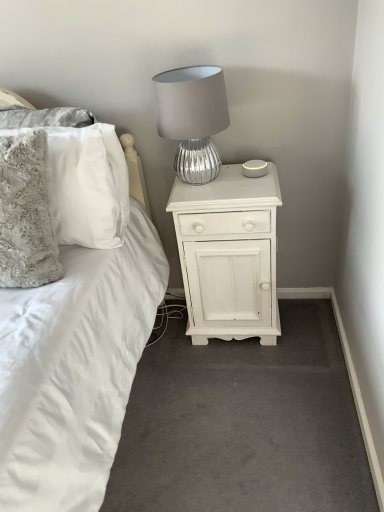
Question: From the image's perspective, is white painted wood nightstand at center positioned above or below fluffy gray pillow at left, marked as the 1th pillow in a front-to-back arrangement?

Choices:
 (A) above
 (B) below

Answer: (B)

Question: From a real-world perspective, is white painted wood nightstand at center positioned above or below fluffy gray pillow at left, marked as the 1th pillow in a front-to-back arrangement?

Choices:
 (A) above
 (B) below

Answer: (B)

Question: Which is nearer to the fluffy gray pillow at left, marked as the 1th pillow in a front-to-back arrangement?

Choices:
 (A) fluffy white pillow at left, which is the second pillow from front to back
 (B) white painted wood nightstand at center
 (C) silver textured lamp at upper center

Answer: (A)

Question: Considering the real-world distances, which object is farthest from the white painted wood nightstand at center?

Choices:
 (A) fluffy gray pillow at left, the 2th pillow in the back-to-front sequence
 (B) silver textured lamp at upper center
 (C) fluffy white pillow at left, which is the second pillow from front to back

Answer: (A)